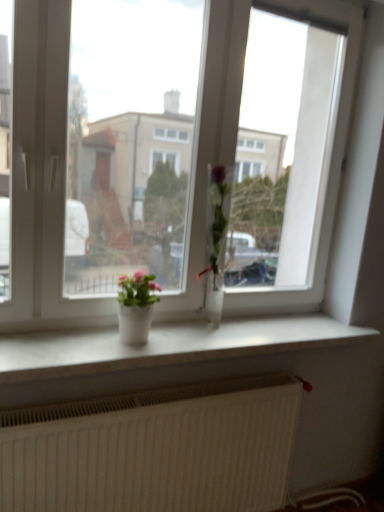
Question: From the image's perspective, is matte white pot at center, which is the second houseplant in right-to-left order, under clear glass vase at center, marked as the first houseplant in a right-to-left arrangement?

Choices:
 (A) no
 (B) yes

Answer: (B)

Question: From a real-world perspective, is matte white pot at center, which is the second houseplant in right-to-left order, positioned under clear glass vase at center, marked as the first houseplant in a right-to-left arrangement, based on gravity?

Choices:
 (A) no
 (B) yes

Answer: (B)

Question: Is matte white pot at center, which is the second houseplant in right-to-left order, behind clear glass vase at center, marked as the first houseplant in a right-to-left arrangement?

Choices:
 (A) no
 (B) yes

Answer: (A)

Question: Can you see matte white pot at center, which is the second houseplant in right-to-left order, touching clear glass vase at center, marked as the first houseplant in a right-to-left arrangement?

Choices:
 (A) yes
 (B) no

Answer: (B)

Question: From a real-world perspective, is matte white pot at center, which is the second houseplant in right-to-left order, physically above clear glass vase at center, marked as the first houseplant in a right-to-left arrangement?

Choices:
 (A) yes
 (B) no

Answer: (B)

Question: Considering the positions of point (139, 293) and point (3, 489), is point (139, 293) closer or farther from the camera than point (3, 489)?

Choices:
 (A) farther
 (B) closer

Answer: (A)

Question: In the image, is matte white pot at center, arranged as the first houseplant when viewed from the left, on the left side or the right side of white textured radiator at lower center?

Choices:
 (A) right
 (B) left

Answer: (B)

Question: Choose the correct answer: Is matte white pot at center, which is the second houseplant in right-to-left order, inside white textured radiator at lower center or outside it?

Choices:
 (A) inside
 (B) outside

Answer: (B)

Question: From a real-world perspective, relative to white textured radiator at lower center, is matte white pot at center, arranged as the first houseplant when viewed from the left, vertically above or below?

Choices:
 (A) above
 (B) below

Answer: (A)

Question: Based on their positions, is white marble window sill at center located to the left or right of transparent glass window at center?

Choices:
 (A) left
 (B) right

Answer: (B)

Question: Looking at their shapes, would you say white marble window sill at center is wider or thinner than transparent glass window at center?

Choices:
 (A) thin
 (B) wide

Answer: (B)

Question: Considering the positions of white marble window sill at center and transparent glass window at center in the image, is white marble window sill at center taller or shorter than transparent glass window at center?

Choices:
 (A) tall
 (B) short

Answer: (B)

Question: Considering their positions, is white marble window sill at center located in front of or behind transparent glass window at center?

Choices:
 (A) behind
 (B) front

Answer: (A)

Question: Is point (150, 354) positioned closer to the camera than point (206, 245)?

Choices:
 (A) farther
 (B) closer

Answer: (B)

Question: From the image's perspective, is white marble window sill at center positioned above or below clear glass vase at center, marked as the first houseplant in a right-to-left arrangement?

Choices:
 (A) above
 (B) below

Answer: (B)